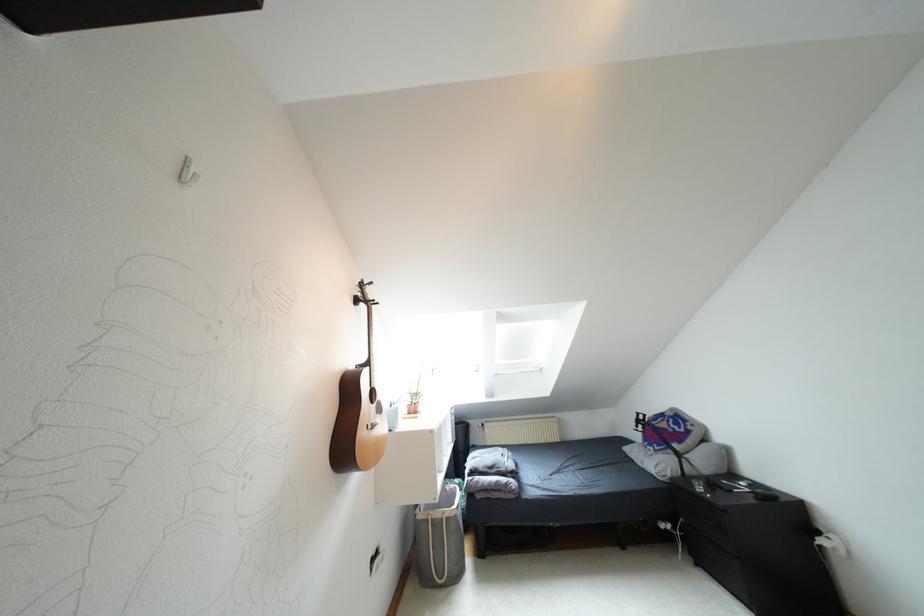
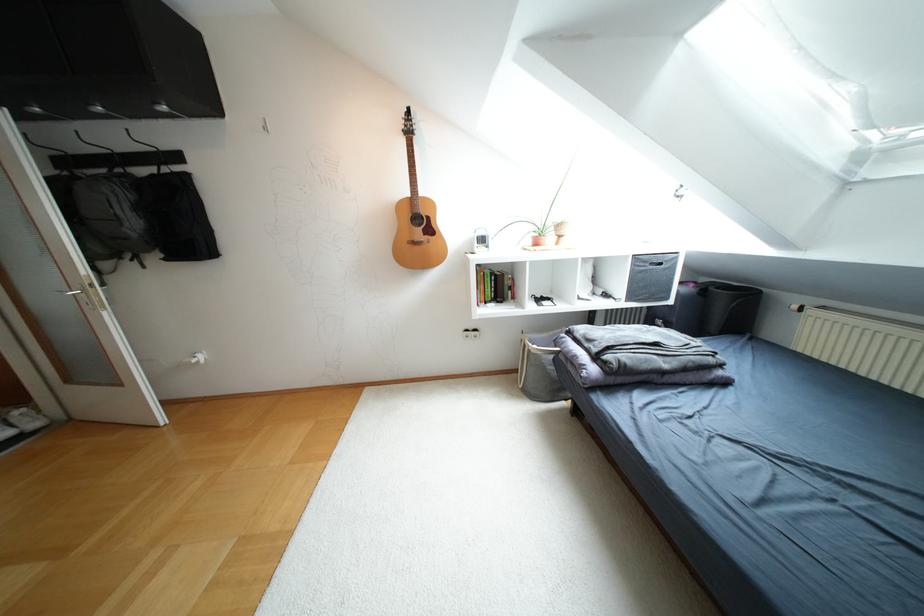
Find the pixel in the second image that matches point (446, 517) in the first image.

(528, 350)